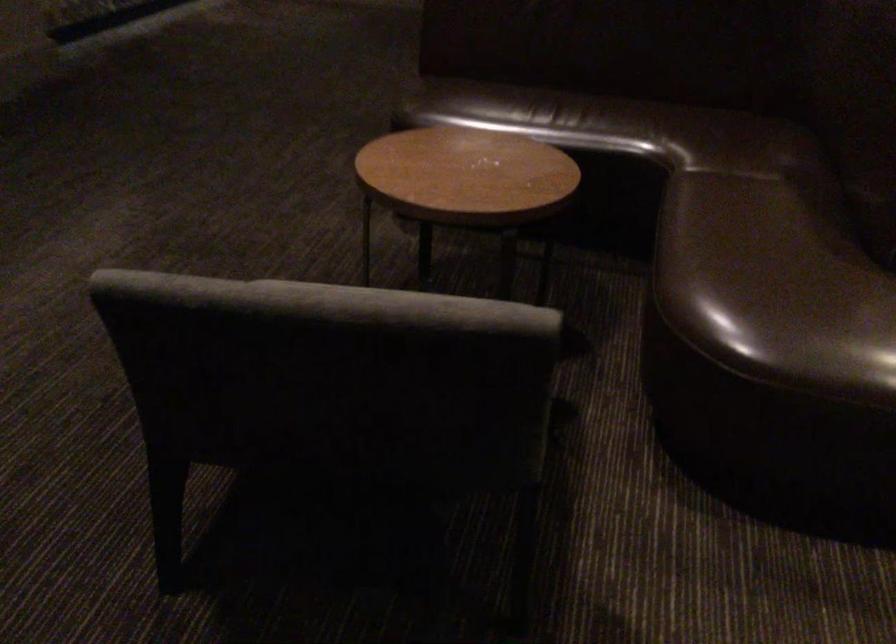
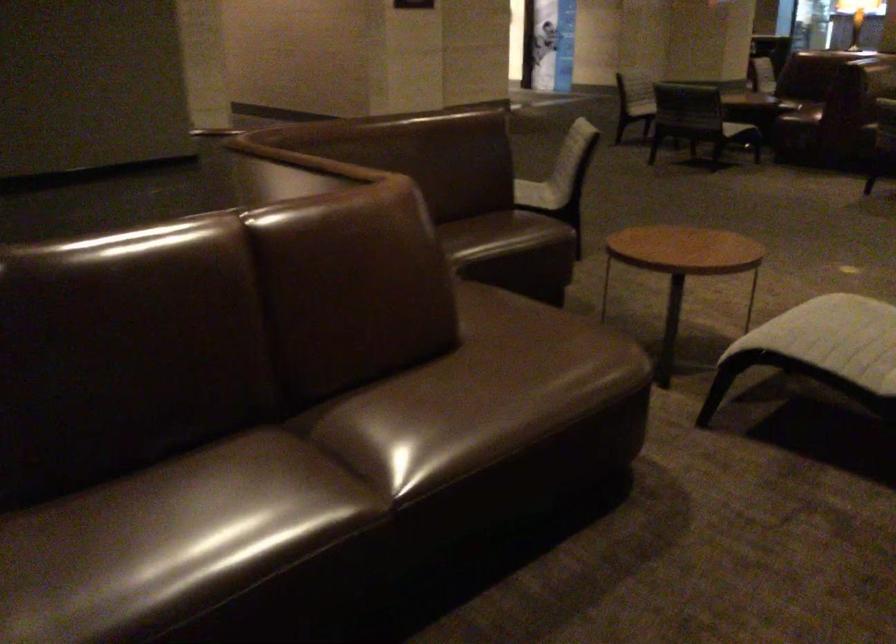
Question: Based on the continuous images, in which direction is the camera rotating? Reply with the corresponding letter.

Choices:
 (A) Left
 (B) Right
 (C) Up
 (D) Down

Answer: (B)